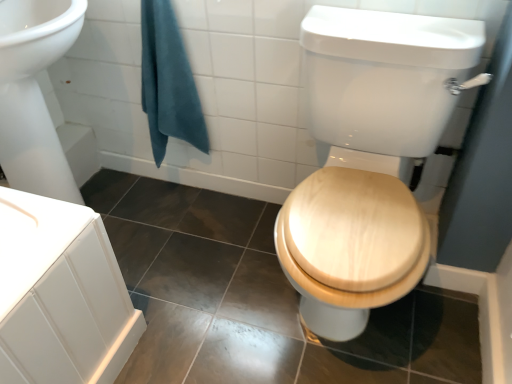
What is the approximate height of teal cotton towel at upper left?

The height of teal cotton towel at upper left is 24.14 inches.

What do you see at coordinates (168, 82) in the screenshot? The width and height of the screenshot is (512, 384). I see `teal cotton towel at upper left` at bounding box center [168, 82].

In order to click on teal cotton towel at upper left in this screenshot , I will do [x=168, y=82].

Where is `wooden toilet seat at center`? The height and width of the screenshot is (384, 512). wooden toilet seat at center is located at coordinates (368, 158).

The width and height of the screenshot is (512, 384). Describe the element at coordinates (368, 158) in the screenshot. I see `wooden toilet seat at center` at that location.

Image resolution: width=512 pixels, height=384 pixels. Identify the location of teal cotton towel at upper left. (168, 82).

In the scene shown: Does wooden toilet seat at center appear on the left side of teal cotton towel at upper left?

In fact, wooden toilet seat at center is to the right of teal cotton towel at upper left.

Consider the image. Is the position of wooden toilet seat at center more distant than that of teal cotton towel at upper left?

No, the depth of wooden toilet seat at center is less than that of teal cotton towel at upper left.

Which is less distant, [457,46] or [153,139]?

The point [457,46] is closer.

From the image's perspective, which one is positioned higher, wooden toilet seat at center or teal cotton towel at upper left?

teal cotton towel at upper left.

From a real-world perspective, which object stands above the other?

teal cotton towel at upper left.

Between wooden toilet seat at center and teal cotton towel at upper left, which one has larger width?

wooden toilet seat at center.

Between wooden toilet seat at center and teal cotton towel at upper left, which one has less height?

With less height is teal cotton towel at upper left.

Can you confirm if wooden toilet seat at center is smaller than teal cotton towel at upper left?

Actually, wooden toilet seat at center might be larger than teal cotton towel at upper left.

Is wooden toilet seat at center spatially inside teal cotton towel at upper left, or outside of it?

wooden toilet seat at center cannot be found inside teal cotton towel at upper left.

Is wooden toilet seat at center directly adjacent to teal cotton towel at upper left?

No, wooden toilet seat at center is not touching teal cotton towel at upper left.

Is wooden toilet seat at center aimed at teal cotton towel at upper left?

No.

From the picture: How different are the orientations of wooden toilet seat at center and teal cotton towel at upper left in degrees?

The angle between the facing direction of wooden toilet seat at center and the facing direction of teal cotton towel at upper left is 0.000751 degrees.

I want to click on bath towel behind the wooden toilet seat at center, so click(168, 82).

Considering the relative positions of teal cotton towel at upper left and wooden toilet seat at center in the image provided, is teal cotton towel at upper left to the left of wooden toilet seat at center from the viewer's perspective?

Yes.

Which is in front, teal cotton towel at upper left or wooden toilet seat at center?

wooden toilet seat at center is closer to the camera.

Is point (142, 85) positioned after point (309, 324)?

Yes, it is.

Consider the image. From the image's perspective, which object appears higher, teal cotton towel at upper left or wooden toilet seat at center?

teal cotton towel at upper left is shown above in the image.

From a real-world perspective, between teal cotton towel at upper left and wooden toilet seat at center, who is vertically lower?

wooden toilet seat at center.

Is teal cotton towel at upper left thinner than wooden toilet seat at center?

Yes.

Can you confirm if teal cotton towel at upper left is shorter than wooden toilet seat at center?

Indeed, teal cotton towel at upper left has a lesser height compared to wooden toilet seat at center.

Looking at the image, does teal cotton towel at upper left seem bigger or smaller compared to wooden toilet seat at center?

Considering their sizes, teal cotton towel at upper left takes up less space than wooden toilet seat at center.

Is teal cotton towel at upper left not within wooden toilet seat at center?

teal cotton towel at upper left lies outside wooden toilet seat at center's area.

Does teal cotton towel at upper left touch wooden toilet seat at center?

No.

In the scene shown: Does teal cotton towel at upper left turn towards wooden toilet seat at center?

No.

What's the angular difference between teal cotton towel at upper left and wooden toilet seat at center's facing directions?

The angular difference between teal cotton towel at upper left and wooden toilet seat at center is 0.000751 degrees.

In order to click on toilet in front of the teal cotton towel at upper left in this screenshot , I will do 368,158.

Identify the location of toilet below the teal cotton towel at upper left (from the image's perspective). pyautogui.click(x=368, y=158).

The image size is (512, 384). I want to click on toilet below the teal cotton towel at upper left (from a real-world perspective), so click(x=368, y=158).